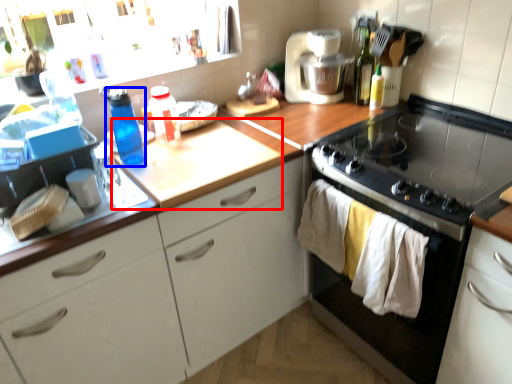
Question: Which of the following is the farthest to the observer, counter top (highlighted by a red box) or bottle (highlighted by a blue box)?

Choices:
 (A) counter top
 (B) bottle

Answer: (B)